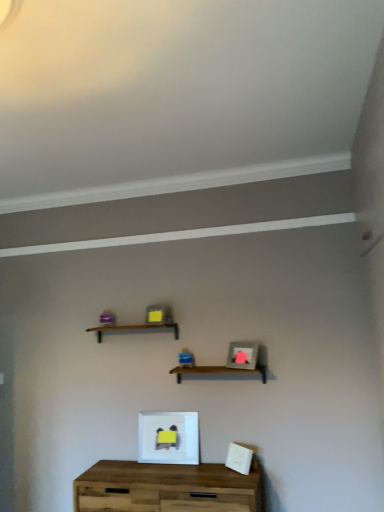
Question: Considering the relative sizes of wooden table at center and wooden shelf at center, acting as the first shelf starting from the top, in the image provided, is wooden table at center bigger than wooden shelf at center, acting as the first shelf starting from the top,?

Choices:
 (A) yes
 (B) no

Answer: (A)

Question: From the image's perspective, is wooden table at center on top of wooden shelf at center, positioned as the second shelf in right-to-left order?

Choices:
 (A) yes
 (B) no

Answer: (B)

Question: From the image's perspective, is wooden table at center below wooden shelf at center, positioned as the second shelf in right-to-left order?

Choices:
 (A) no
 (B) yes

Answer: (B)

Question: Could you tell me if wooden table at center is facing wooden shelf at center, which is the 1th shelf from left to right?

Choices:
 (A) yes
 (B) no

Answer: (B)

Question: From a real-world perspective, does wooden table at center sit lower than wooden shelf at center, acting as the first shelf starting from the top?

Choices:
 (A) yes
 (B) no

Answer: (A)

Question: Is wooden shelf at center, acting as the first shelf starting from the top, spatially inside wooden at center, arranged as the first shelf when ordered from the bottom, or outside of it?

Choices:
 (A) outside
 (B) inside

Answer: (A)

Question: Considering their positions, is wooden shelf at center, marked as the second shelf in a bottom-to-top arrangement, located in front of or behind wooden at center, the 2th shelf positioned from the top?

Choices:
 (A) front
 (B) behind

Answer: (B)

Question: From the image's perspective, relative to wooden at center, the 2th shelf from the left, is wooden shelf at center, which is the 1th shelf from left to right, above or below?

Choices:
 (A) below
 (B) above

Answer: (B)

Question: From a real-world perspective, is wooden shelf at center, acting as the first shelf starting from the top, above or below wooden at center, which is counted as the first shelf, starting from the right?

Choices:
 (A) above
 (B) below

Answer: (A)

Question: In terms of width, does wooden at center, which is counted as the first shelf, starting from the right, look wider or thinner when compared to white matte picture frame at center, marked as the second picture frame in a right-to-left arrangement?

Choices:
 (A) thin
 (B) wide

Answer: (B)

Question: From the image's perspective, is wooden at center, the 2th shelf from the left, above or below white matte picture frame at center, which ranks as the first picture frame in bottom-to-top order?

Choices:
 (A) above
 (B) below

Answer: (A)

Question: Considering their positions, is wooden at center, which is counted as the first shelf, starting from the right, located in front of or behind white matte picture frame at center, the 2th picture frame from the top?

Choices:
 (A) front
 (B) behind

Answer: (A)

Question: Considering the positions of point pyautogui.click(x=182, y=371) and point pyautogui.click(x=148, y=418), is point pyautogui.click(x=182, y=371) closer or farther from the camera than point pyautogui.click(x=148, y=418)?

Choices:
 (A) closer
 (B) farther

Answer: (A)

Question: Does point (231, 351) appear closer or farther from the camera than point (142, 415)?

Choices:
 (A) farther
 (B) closer

Answer: (B)

Question: Is matte gray picture frame at center, positioned as the first picture frame in right-to-left order, taller or shorter than white matte picture frame at center, which ranks as the first picture frame in bottom-to-top order?

Choices:
 (A) tall
 (B) short

Answer: (B)